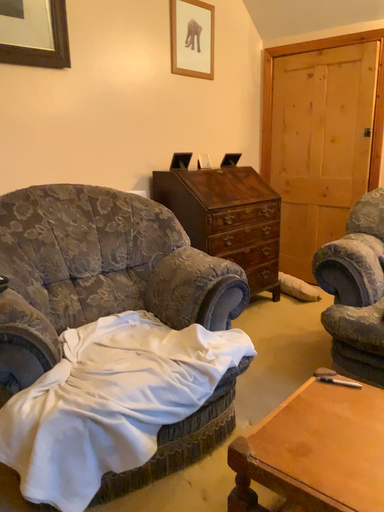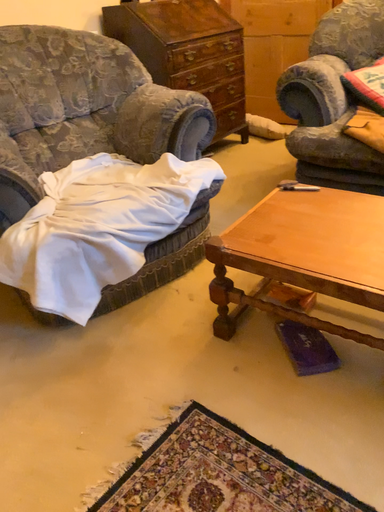
Question: How did the camera likely rotate when shooting the video?

Choices:
 (A) rotated downward
 (B) rotated upward

Answer: (A)